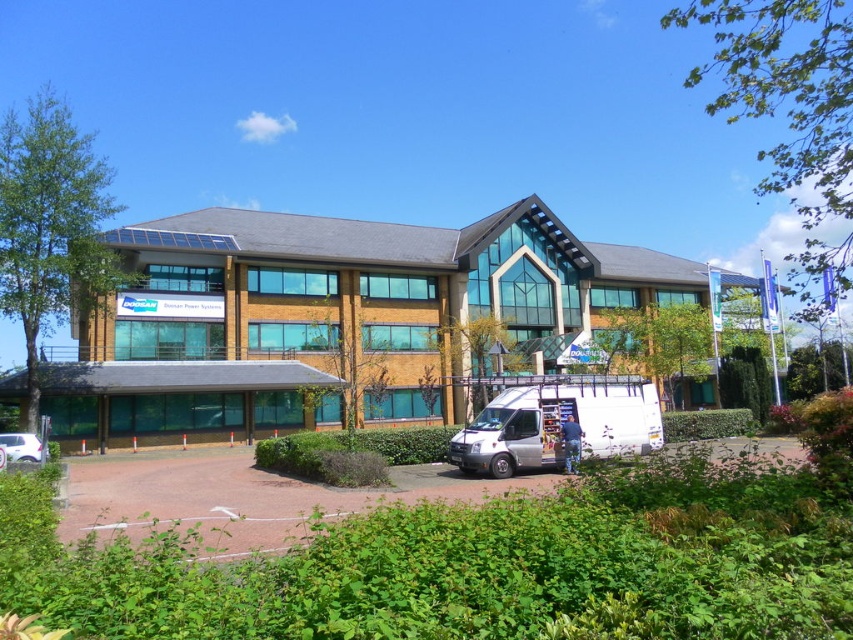
Who is positioned more to the left, green leafy park at lower center or white matte van at lower center?

green leafy park at lower center

Which is in front, point (444, 504) or point (595, 417)?

Point (444, 504)

Find the location of `green leafy park at lower center`. green leafy park at lower center is located at coordinates (492, 564).

Between green leafy park at lower center and matte brown building at center, which one has less height?

With less height is green leafy park at lower center.

Which is in front, point (428, 625) or point (436, 307)?

Positioned in front is point (428, 625).

The width and height of the screenshot is (853, 640). Identify the location of green leafy park at lower center. (492, 564).

Identify the location of white matte van at lower center. [558, 422].

Find the location of a particular element. white matte van at lower center is located at coordinates [558, 422].